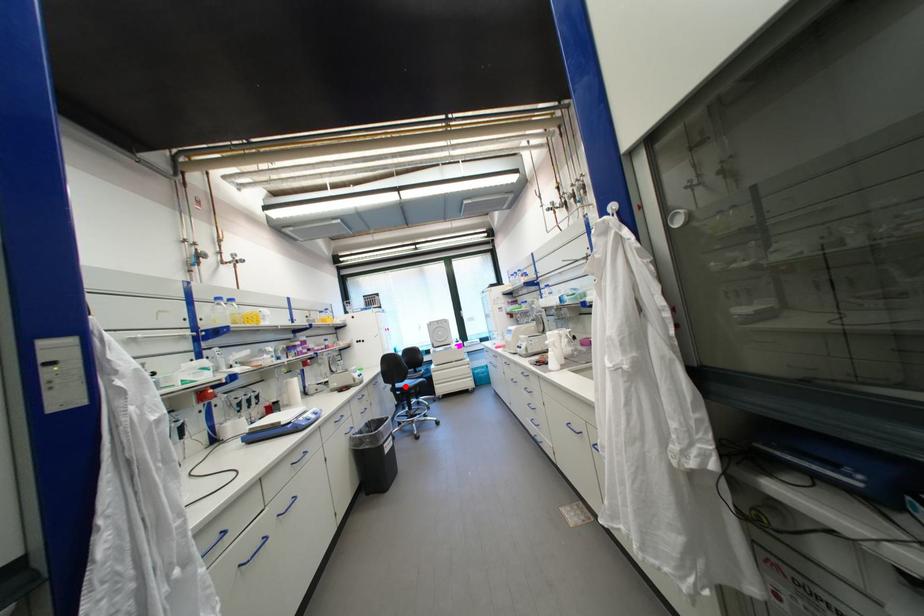
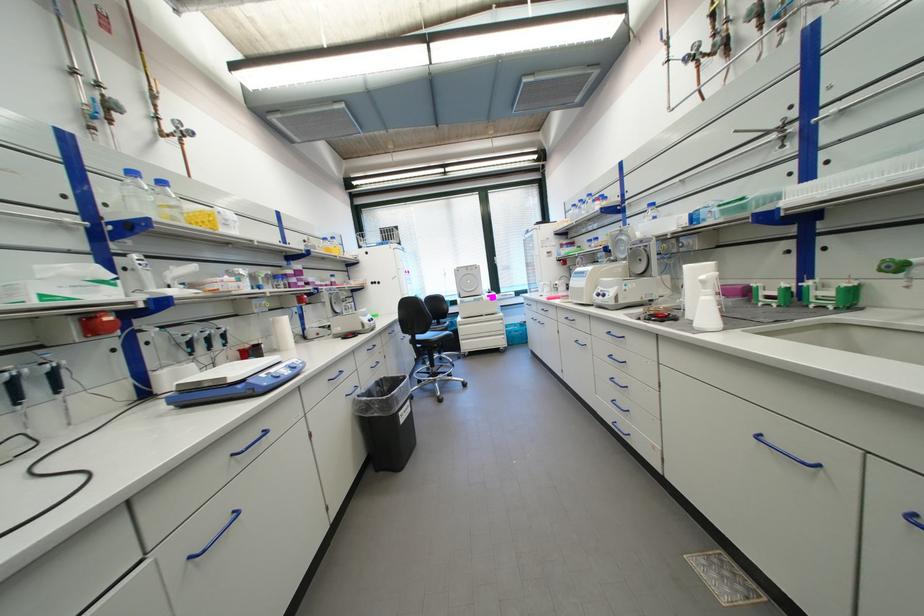
The point at the highlighted location is marked in the first image. Where is the corresponding point in the second image?

(427, 338)